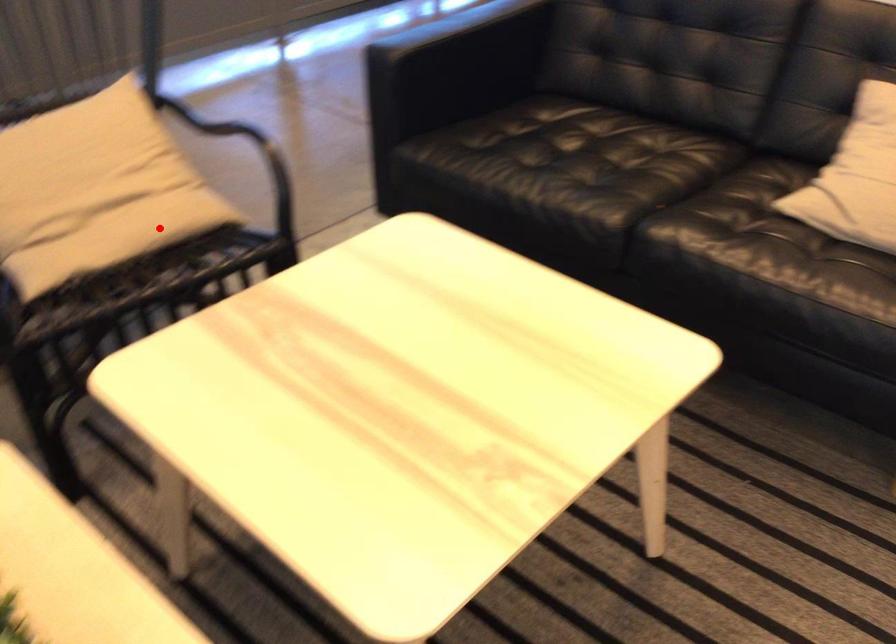
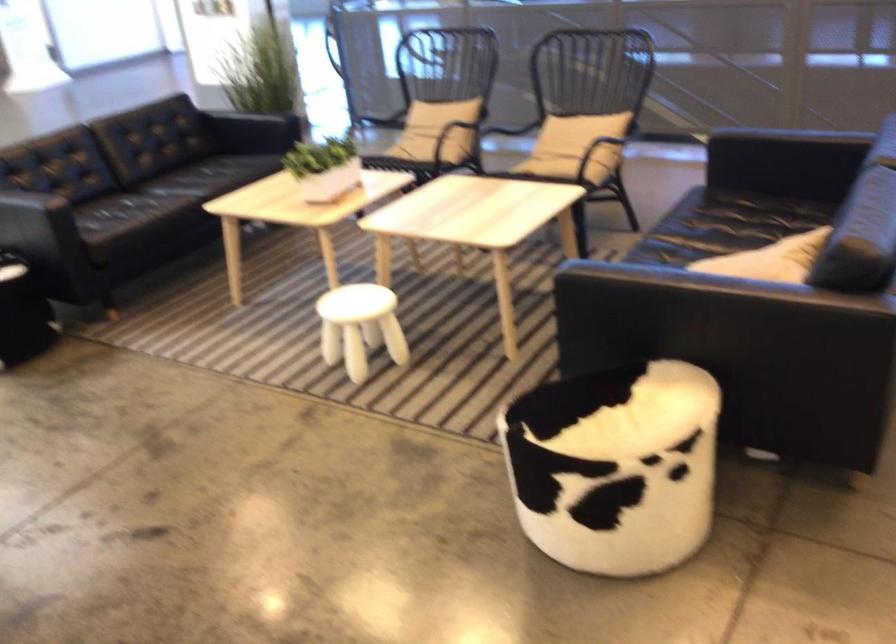
Question: I am providing you with two images of the same scene from different viewpoints. A red point is marked on the first image. Can you still see the location of the red point in image 2?

Choices:
 (A) Yes
 (B) No

Answer: (A)